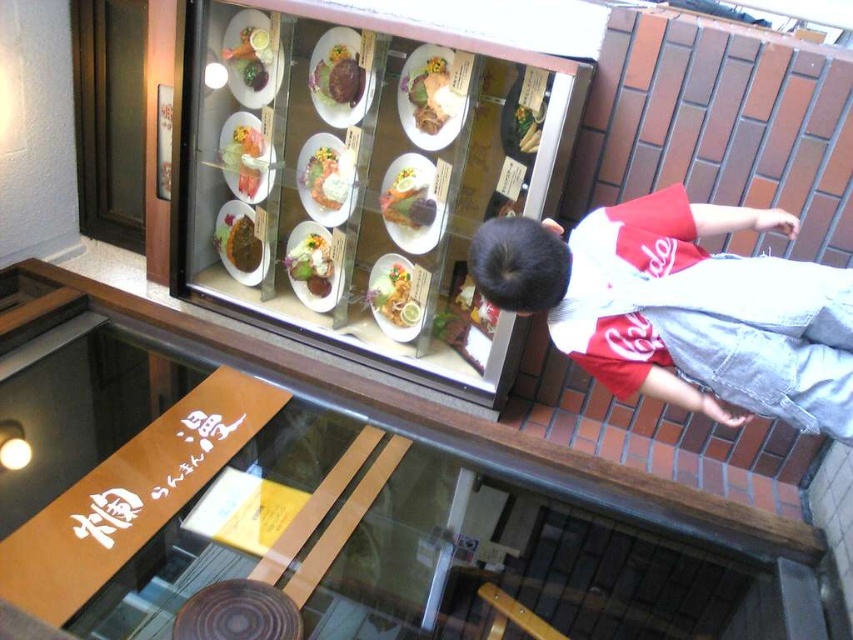
How far apart are shiny silver fish at center and smooth white plate at upper center?

shiny silver fish at center and smooth white plate at upper center are 23.67 inches apart.

From the picture: Which is below, shiny silver fish at center or smooth white plate at upper center?

shiny silver fish at center

At what (x,y) coordinates should I click in order to perform the action: click on shiny silver fish at center. Please return your answer as a coordinate pair (x, y). This screenshot has height=640, width=853. Looking at the image, I should click on (408, 198).

Is red cotton shirt at upper right below brown wooden ledge at upper center?

Actually, red cotton shirt at upper right is above brown wooden ledge at upper center.

Which is below, red cotton shirt at upper right or brown wooden ledge at upper center?

brown wooden ledge at upper center is below.

Does point (560, 289) lie behind point (715, 525)?

No, (560, 289) is closer to viewer.

Find the location of `red cotton shirt at upper right`. red cotton shirt at upper right is located at coordinates (682, 308).

What do you see at coordinates (682, 308) in the screenshot? This screenshot has width=853, height=640. I see `red cotton shirt at upper right` at bounding box center [682, 308].

Measure the distance between red cotton shirt at upper right and smooth white plate at center.

35.21 inches

Is point (666, 344) farther from camera compared to point (427, 115)?

No, it is in front of (427, 115).

Identify the location of red cotton shirt at upper right. Image resolution: width=853 pixels, height=640 pixels. (682, 308).